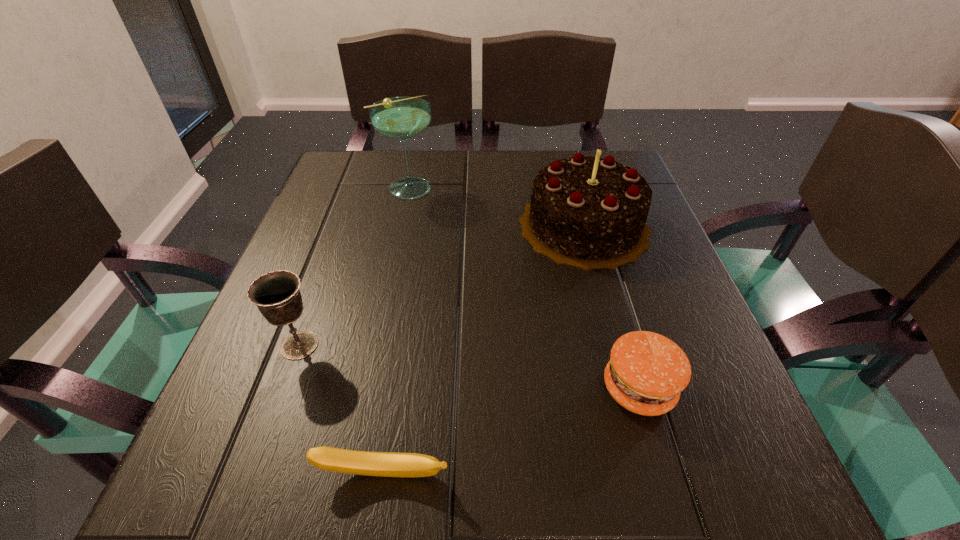
Find the location of `blank space located on the back of the fourth tallest object`. blank space located on the back of the fourth tallest object is located at coordinates click(587, 213).

This screenshot has height=540, width=960. In order to click on martini situated at the far edge in this screenshot , I will do `click(403, 117)`.

This screenshot has height=540, width=960. In order to click on birthday cake that is at the far edge in this screenshot , I will do `click(588, 212)`.

You are a GUI agent. You are given a task and a screenshot of the screen. Output one action in this format:
    pyautogui.click(x=<x>, y=<y>)
    Task: Click on the object situated at the near edge
    The width and height of the screenshot is (960, 540).
    Given the screenshot: What is the action you would take?
    pyautogui.click(x=386, y=464)

Locate an element on the screen. The width and height of the screenshot is (960, 540). martini situated at the left edge is located at coordinates (403, 117).

I want to click on chalice that is at the left edge, so click(276, 294).

This screenshot has height=540, width=960. I want to click on birthday cake at the right edge, so click(588, 212).

I want to click on patty that is at the right edge, so click(x=647, y=371).

Locate an element on the screen. The height and width of the screenshot is (540, 960). object located in the far left corner section of the desktop is located at coordinates (403, 117).

The width and height of the screenshot is (960, 540). In order to click on object that is at the far right corner in this screenshot , I will do `click(588, 212)`.